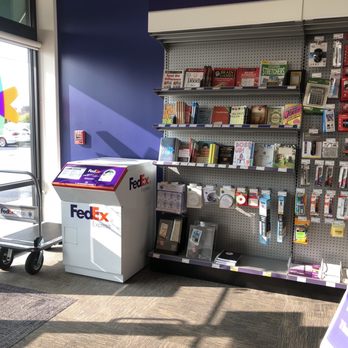
Where is `blue wall`? blue wall is located at coordinates (111, 125).